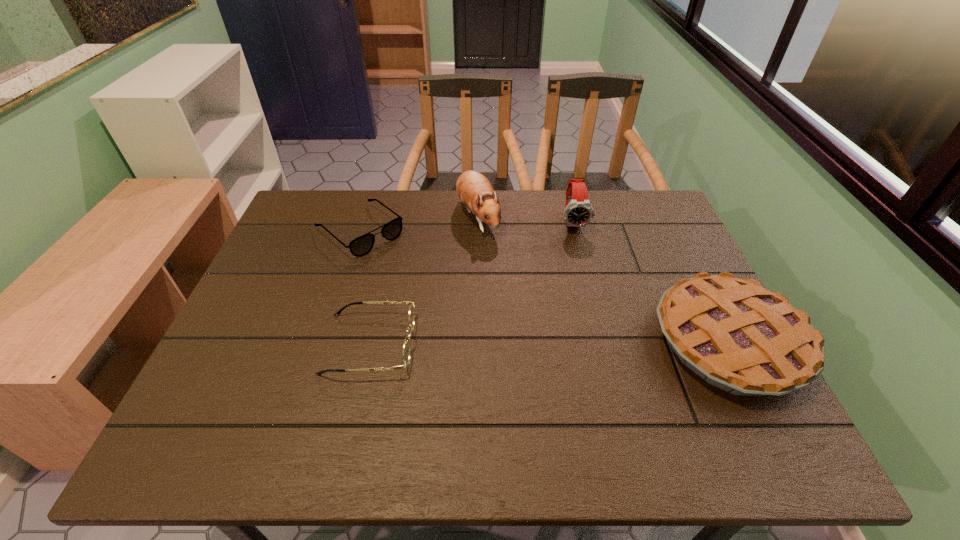
This screenshot has width=960, height=540. What are the coordinates of `the nearer spectacles` in the screenshot? It's located at (406, 347).

Where is `the rightmost object`? The height and width of the screenshot is (540, 960). the rightmost object is located at coordinates (738, 336).

Where is `hamster`? hamster is located at coordinates (473, 188).

Image resolution: width=960 pixels, height=540 pixels. What are the coordinates of `the second object from right to left` in the screenshot? It's located at (578, 212).

You are a GUI agent. You are given a task and a screenshot of the screen. Output one action in this format:
    pyautogui.click(x=<x>, y=<y>)
    Task: Click on the farther spectacles
    Image resolution: width=960 pixels, height=540 pixels.
    Given the screenshot: What is the action you would take?
    pyautogui.click(x=360, y=246)

Where is `vacant space located 0.150m on the lenses of the nearer spectacles`? This screenshot has width=960, height=540. vacant space located 0.150m on the lenses of the nearer spectacles is located at coordinates (478, 343).

You are a GUI agent. You are given a task and a screenshot of the screen. Output one action in this format:
    pyautogui.click(x=<x>, y=<y>)
    Task: Click on the vacant area situated 0.400m on the back of the rightmost object
    The height and width of the screenshot is (540, 960).
    Given the screenshot: What is the action you would take?
    pyautogui.click(x=659, y=201)

I want to click on free space located at the face of the hamster, so (x=530, y=341).

Identify the location of vacant point located 0.110m at the face of the hamster. This screenshot has width=960, height=540. (495, 266).

I want to click on vacant space located at the face of the hamster, so click(x=517, y=313).